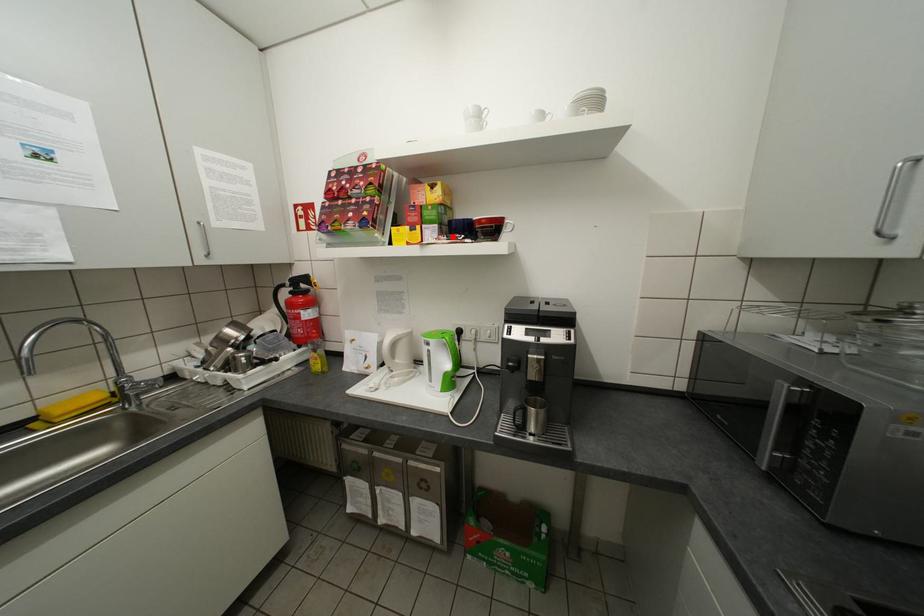
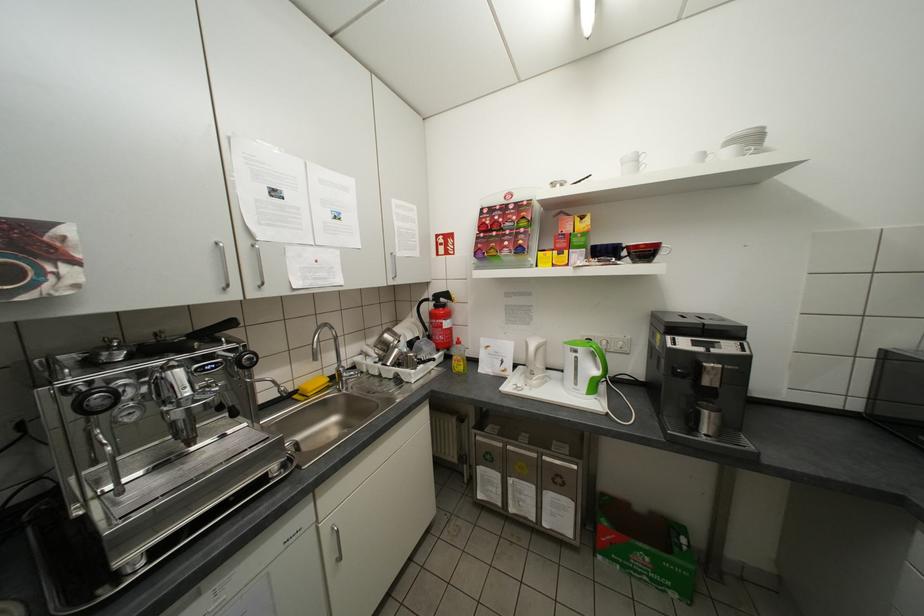
Where in the second image is the point corresponding to the highlighted location from the first image?

(603, 259)